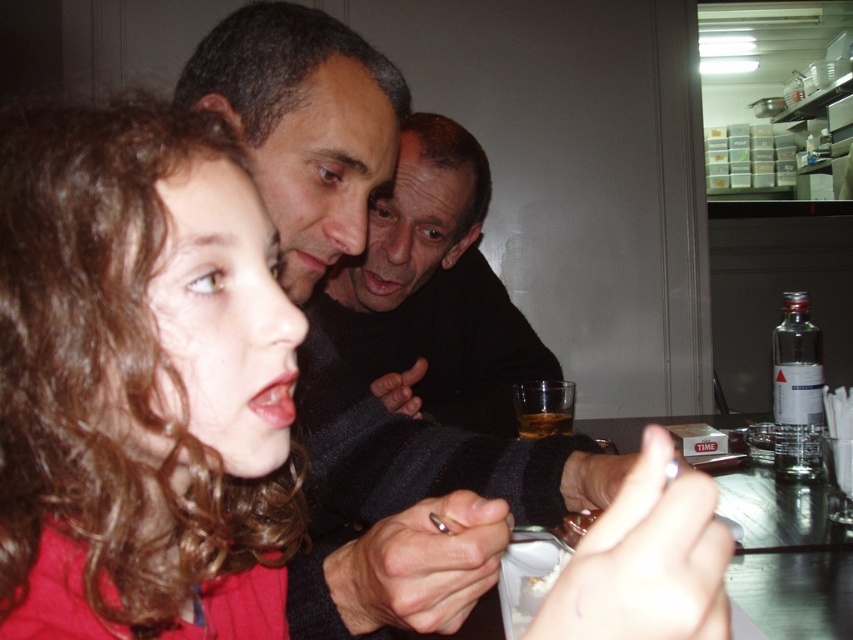
Which is in front, point (15, 416) or point (523, 420)?

Point (15, 416) is more forward.

Between curly hair at center and translucent glass bottle at center, which one appears on the left side from the viewer's perspective?

curly hair at center is more to the left.

The image size is (853, 640). Describe the element at coordinates (140, 381) in the screenshot. I see `curly hair at center` at that location.

Locate an element on the screen. This screenshot has height=640, width=853. curly hair at center is located at coordinates (140, 381).

Is dark matte face at center bigger than translucent glass bottle at center?

Indeed, dark matte face at center has a larger size compared to translucent glass bottle at center.

Can you confirm if dark matte face at center is smaller than translucent glass bottle at center?

Incorrect, dark matte face at center is not smaller in size than translucent glass bottle at center.

What do you see at coordinates (434, 291) in the screenshot? This screenshot has height=640, width=853. I see `dark matte face at center` at bounding box center [434, 291].

Identify the location of dark matte face at center. The image size is (853, 640). (434, 291).

Is curly hair at center smaller than dark matte face at center?

Yes.

Is the position of curly hair at center more distant than that of dark matte face at center?

That is False.

This screenshot has width=853, height=640. Identify the location of curly hair at center. (140, 381).

Find the location of a particular element. This screenshot has height=640, width=853. curly hair at center is located at coordinates coord(140,381).